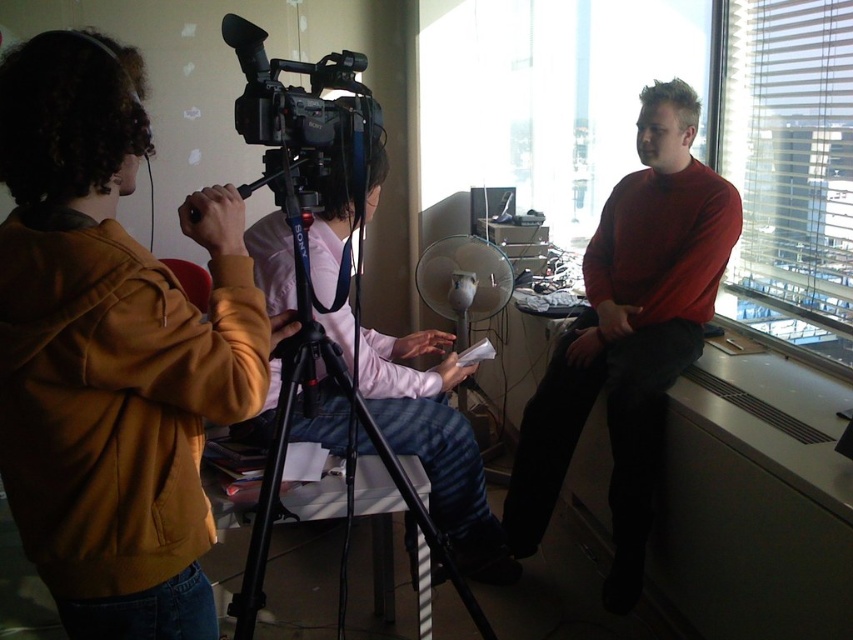
Between matte yellow hoodie at left and transparent glass window at right, which one is positioned higher?

transparent glass window at right is above.

Which of these two, matte yellow hoodie at left or transparent glass window at right, stands taller?

Standing taller between the two is transparent glass window at right.

Which is in front, point (196, 433) or point (747, 211)?

Point (196, 433)

You are a GUI agent. You are given a task and a screenshot of the screen. Output one action in this format:
    pyautogui.click(x=<x>, y=<y>)
    Task: Click on the matte yellow hoodie at left
    The image size is (853, 640).
    Given the screenshot: What is the action you would take?
    pyautogui.click(x=111, y=349)

Is matte yellow hoodie at left below black plastic tripod at center?

Actually, matte yellow hoodie at left is above black plastic tripod at center.

In the scene shown: Is matte yellow hoodie at left further to the viewer compared to black plastic tripod at center?

No, matte yellow hoodie at left is in front of black plastic tripod at center.

The image size is (853, 640). What are the coordinates of `matte yellow hoodie at left` in the screenshot? It's located at (111, 349).

Between matte yellow hoodie at left and matte red sweater at right, which one is positioned lower?

matte red sweater at right

Does matte yellow hoodie at left appear under matte red sweater at right?

Actually, matte yellow hoodie at left is above matte red sweater at right.

This screenshot has width=853, height=640. In order to click on matte yellow hoodie at left in this screenshot , I will do `click(111, 349)`.

Where is `matte yellow hoodie at left`? matte yellow hoodie at left is located at coordinates (111, 349).